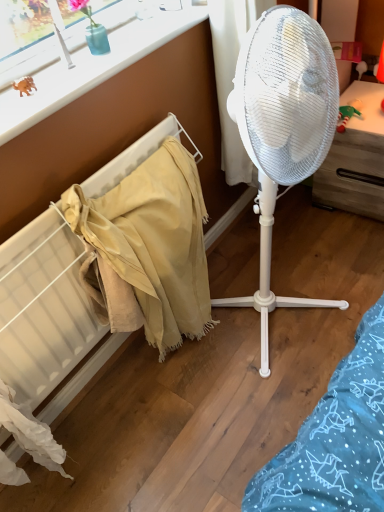
Question: Considering the positions of rubber orange dinosaur at upper left and white plastic drawer at right in the image, is rubber orange dinosaur at upper left wider or thinner than white plastic drawer at right?

Choices:
 (A) thin
 (B) wide

Answer: (A)

Question: From the image's perspective, relative to white plastic drawer at right, is rubber orange dinosaur at upper left above or below?

Choices:
 (A) below
 (B) above

Answer: (A)

Question: Based on their relative distances, which object is farther from the white plastic drawer at right?

Choices:
 (A) beige fabric at left
 (B) rubber orange dinosaur at upper left
 (C) white plastic window frame at upper left
 (D) white plastic fan at center

Answer: (B)

Question: Estimate the real-world distances between objects in this image. Which object is closer to the white plastic fan at center?

Choices:
 (A) rubber orange dinosaur at upper left
 (B) white plastic drawer at right
 (C) beige fabric at left
 (D) white plastic window frame at upper left

Answer: (D)